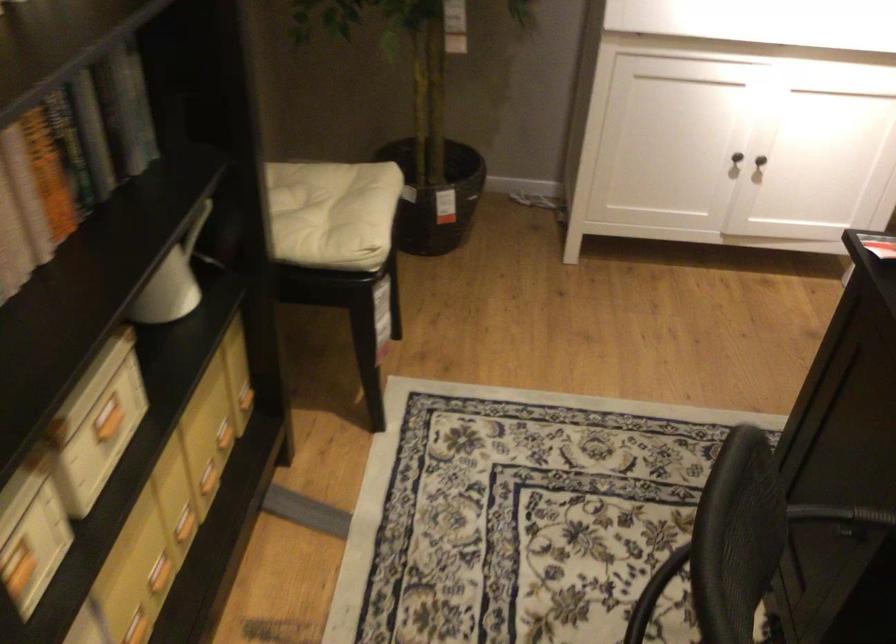
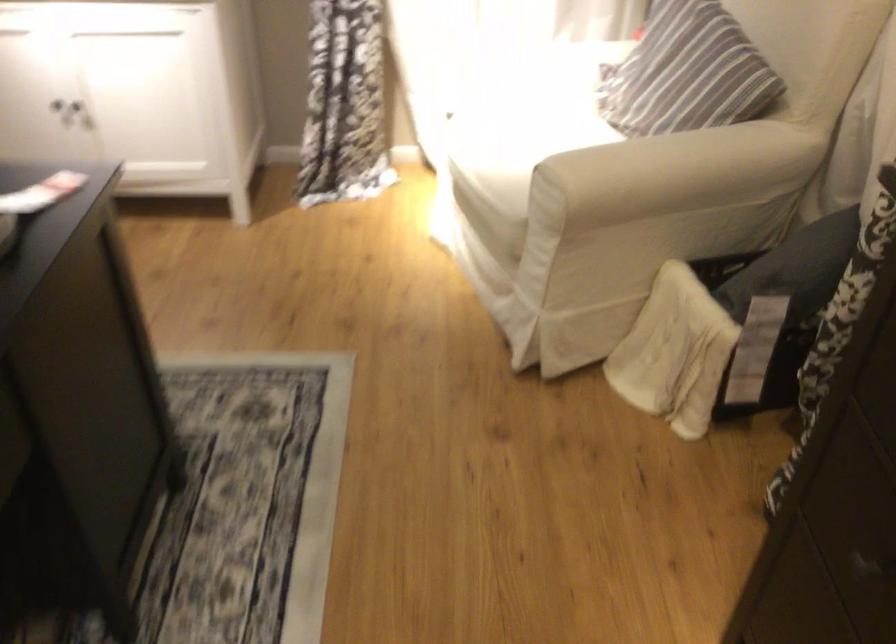
The point at (746, 143) is marked in the first image. Where is the corresponding point in the second image?

(52, 99)